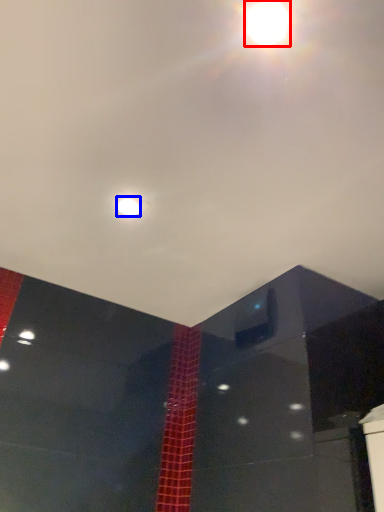
Question: Which point is closer to the camera, lamp (highlighted by a red box) or light (highlighted by a blue box)?

Choices:
 (A) lamp
 (B) light

Answer: (A)